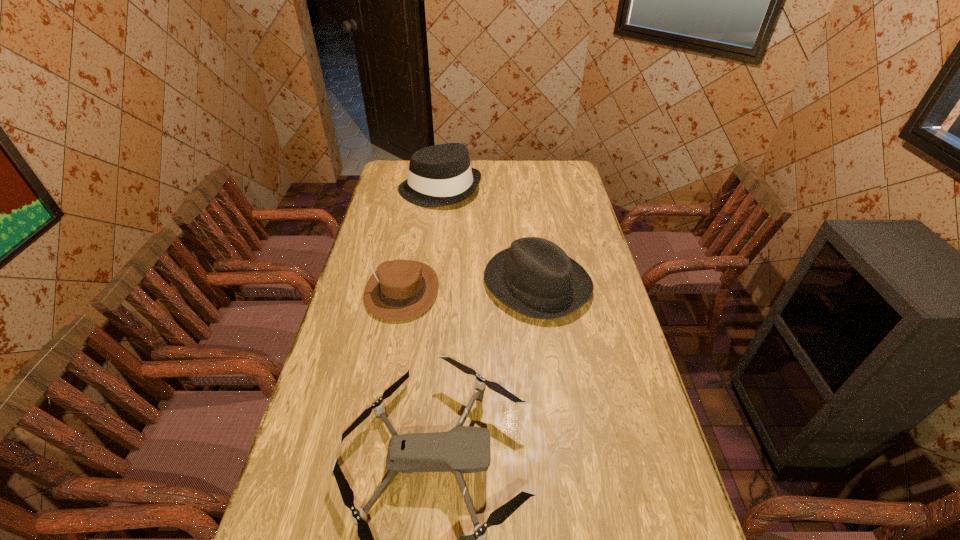
Identify the location of the farthest fedora. The image size is (960, 540). (439, 175).

Where is `the tallest fedora`? The width and height of the screenshot is (960, 540). the tallest fedora is located at coordinates (439, 175).

You are a GUI agent. You are given a task and a screenshot of the screen. Output one action in this format:
    pyautogui.click(x=<x>, y=<y>)
    Task: Click on the rightmost fedora
    This screenshot has height=540, width=960.
    Given the screenshot: What is the action you would take?
    pyautogui.click(x=535, y=277)

Locate an element on the screen. This screenshot has height=540, width=960. free region located 0.320m on the front of the farthest fedora is located at coordinates (431, 256).

Locate an element on the screen. vacant position located 0.240m on the back of the rightmost fedora is located at coordinates (527, 217).

The image size is (960, 540). Find the location of `object that is at the far edge`. object that is at the far edge is located at coordinates (439, 175).

Locate an element on the screen. object that is positioned at the right edge is located at coordinates (535, 277).

This screenshot has width=960, height=540. Find the location of `object present at the far left corner`. object present at the far left corner is located at coordinates (439, 175).

The height and width of the screenshot is (540, 960). I want to click on vacant area at the far edge of the desktop, so click(482, 174).

The image size is (960, 540). I want to click on vacant space at the right edge of the desktop, so click(628, 343).